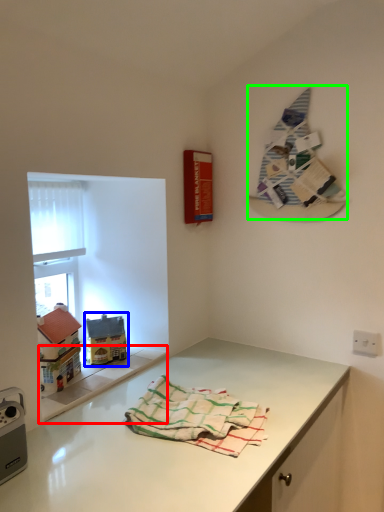
Question: Which object is positioned farthest from window sill (highlighted by a red box)? Select from toy (highlighted by a blue box) and textile (highlighted by a green box).

Choices:
 (A) toy
 (B) textile

Answer: (B)